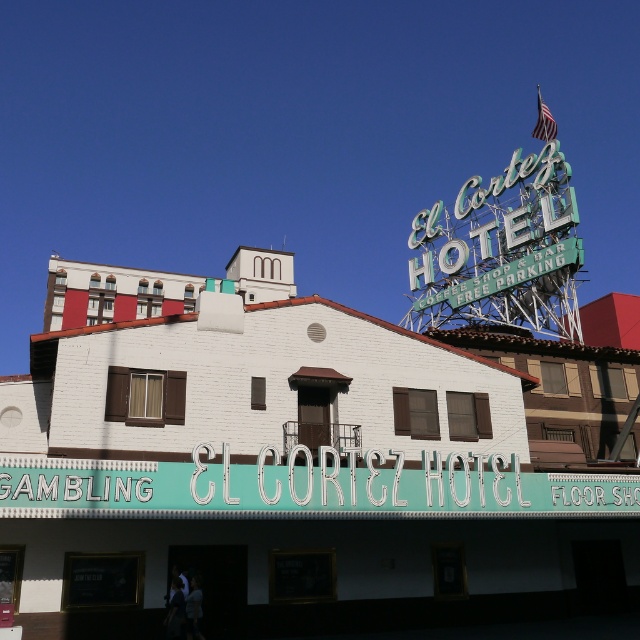
Between point (544, 504) and point (488, 468), which one is positioned behind?

Point (544, 504)

Find the location of a particular element. The height and width of the screenshot is (640, 640). white brick theater at center is located at coordinates [x=280, y=468].